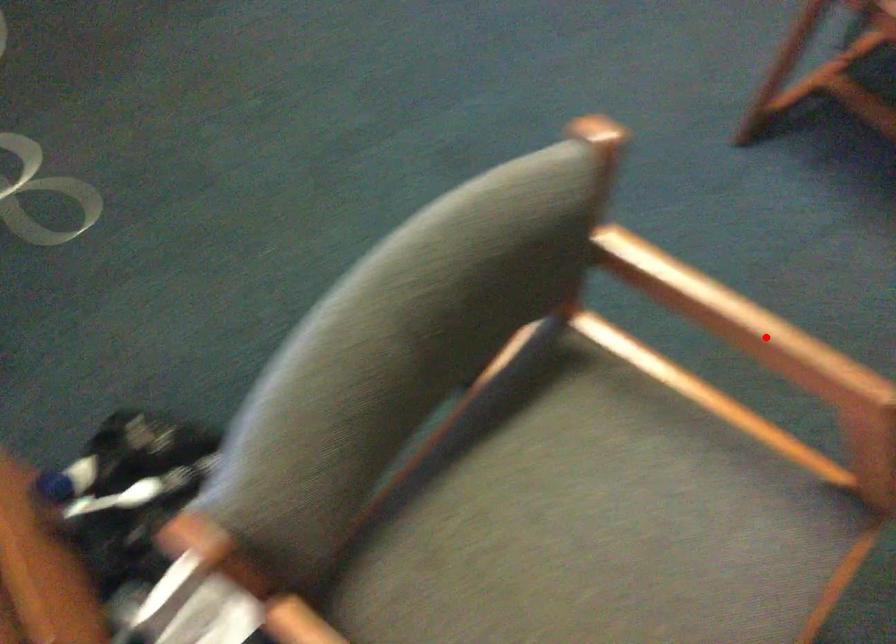
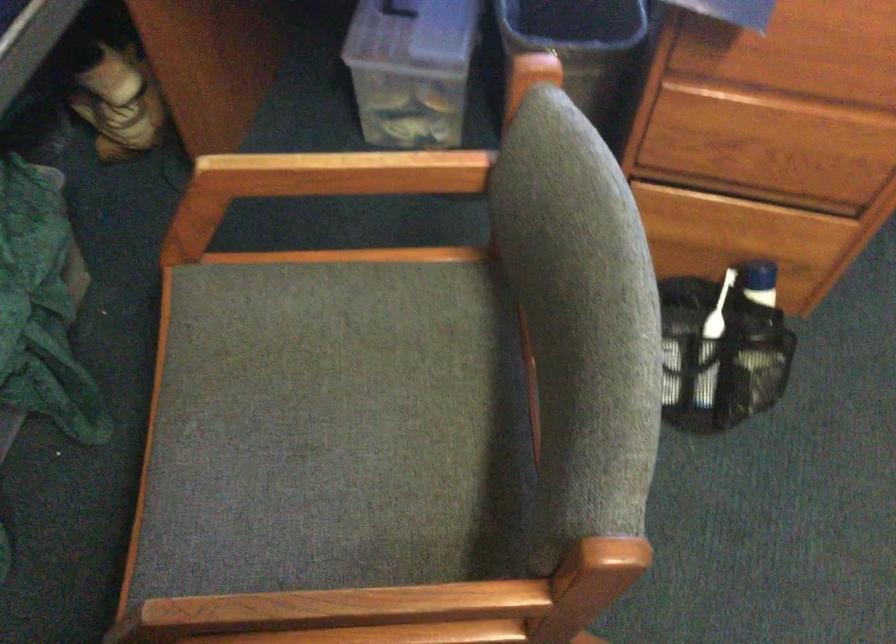
Question: I am providing you with two images of the same scene from different viewpoints. Given a red point in image1, look at the same physical point in image2. Is it:

Choices:
 (A) Closer to the viewpoint
 (B) Farther from the viewpoint

Answer: (A)